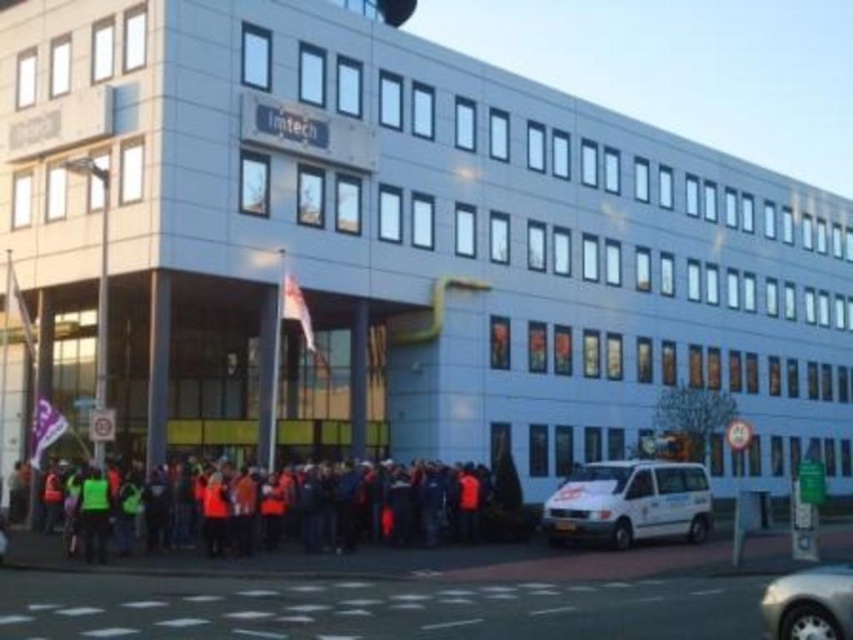
Based on the photo, you are standing at the entrance of the Imtech office building and want to reach a specific point marked at coordinates point (149, 531). If your walking speed is 1.5 meters per second, how many seconds will it take you to reach that point?

The distance to point (149, 531) is 39.34 meters. At a speed of 1.5 meters per second, the time required is 39.34 divided by 1.5, which equals approximately 26.23 seconds.

You are a delivery driver who needs to park your silver metallic car at lower right near the office building. However, there are orange reflective jackets at lower center blocking the parking spot. Can you park there without moving the jackets?

The orange reflective jackets at lower center are positioned on the left side of the silver metallic car at lower right. Since the jackets are already on the left side of where the car would be parked, you can park the silver metallic car at lower right in the spot without needing to move the jackets as they are already to the left of the car.

You are a delivery driver who needs to park your 5.5 meter long truck near the white matte van at lower right without blocking the orange reflective jackets at lower center. Is there enough space between them to park your truck?

The distance between the orange reflective jackets at lower center and the white matte van at lower right is 10.61 meters. Since your truck is 5.5 meters long, there is sufficient space to park it near the white matte van at lower right without blocking the jackets, as 10.61 meters is greater than 5.5 meters.